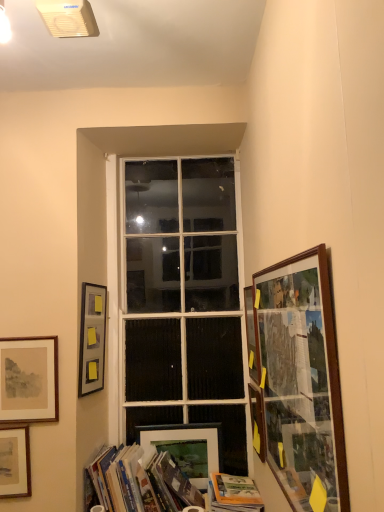
Question: In the image, is matte paper picture frame at lower left, the second picture frame when ordered from left to right, positioned in front of or behind matte white picture frame at lower center, the 4th picture frame when ordered from right to left?

Choices:
 (A) behind
 (B) front

Answer: (B)

Question: From a real-world perspective, is matte paper picture frame at lower left, the second picture frame when ordered from left to right, physically located above or below matte white picture frame at lower center, which is the fourth picture frame in left-to-right order?

Choices:
 (A) above
 (B) below

Answer: (A)

Question: Estimate the real-world distances between objects in this image. Which object is closer to the wooden-framed collage at right, arranged as the sixth picture frame when viewed from the left?

Choices:
 (A) wooden framed map at right, arranged as the 1th picture frame when viewed from the right
 (B) orange matte book at lower center, placed as the 1th book when sorted from right to left
 (C) white glass window at center
 (D) matte paper picture frame at lower left, the second picture frame when ordered from left to right
 (E) wooden picture frame at right, the fifth picture frame when ordered from left to right

Answer: (E)

Question: Considering the real-world distances, which object is farthest from the hardcover books at lower center, the 2th book viewed from the right?

Choices:
 (A) matte gray picture frame at upper left, the 5th picture frame when ordered from right to left
 (B) white glass window at center
 (C) matte brown picture frame at lower left, marked as the seventh picture frame in a right-to-left arrangement
 (D) wooden framed map at right, arranged as the 1th picture frame when viewed from the right
 (E) wooden picture frame at right, the fifth picture frame when ordered from left to right

Answer: (E)